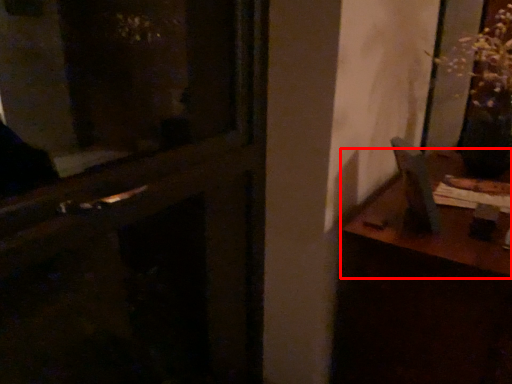
Question: From the image, what is the correct spatial relationship of table (annotated by the red box) in relation to door?

Choices:
 (A) right
 (B) left

Answer: (A)